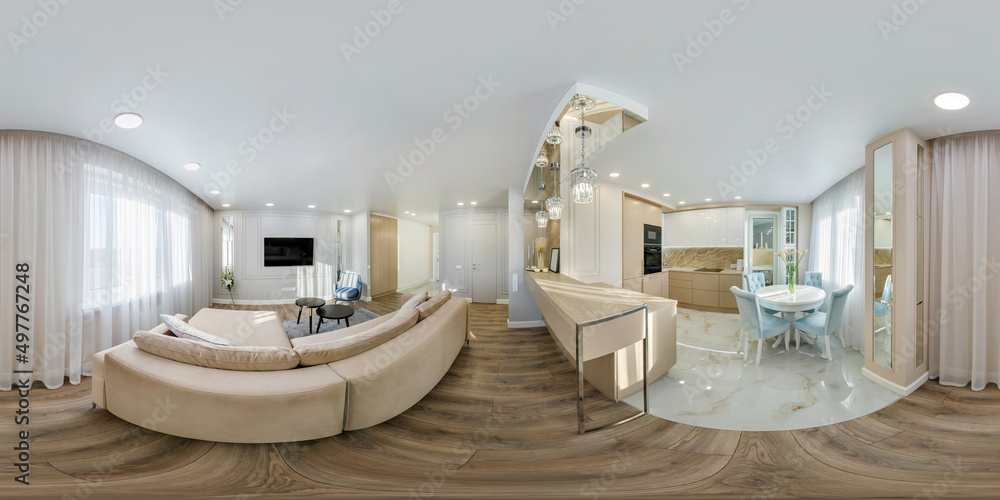
Identify the location of couch. This screenshot has width=1000, height=500. (465, 446), (291, 401).